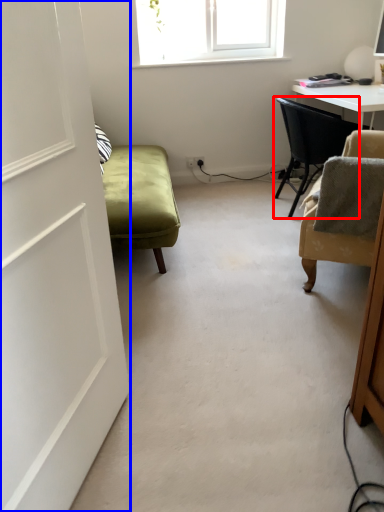
Question: Among these objects, which one is nearest to the camera, chair (highlighted by a red box) or door (highlighted by a blue box)?

Choices:
 (A) chair
 (B) door

Answer: (B)